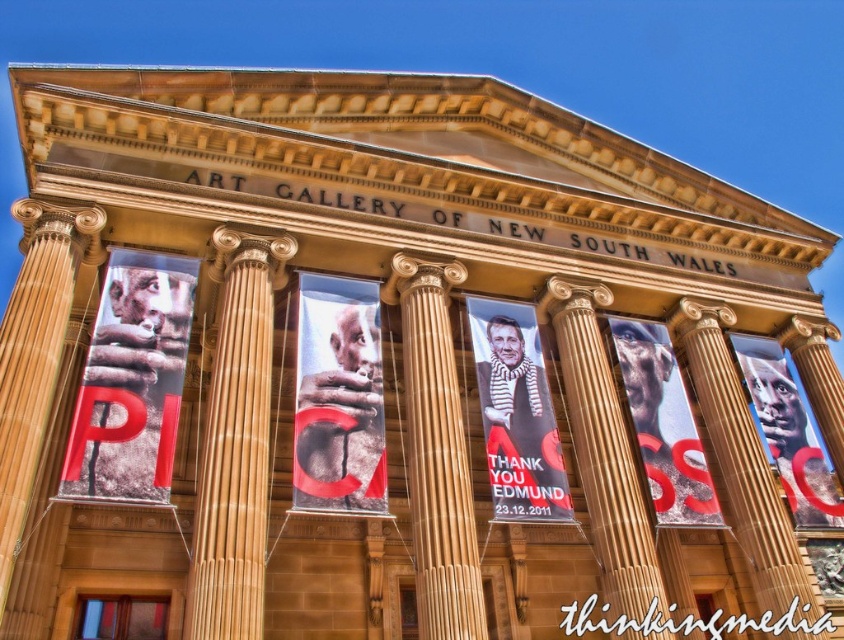
You are an event planner preparing for an outdoor exhibition. You have two items to display near the Art Gallery of New South Wales facade. The items are the matte black banner at left and the matte black face at center. Based on their sizes, which one should you choose if you want to place a larger promotional material near the entrance?

The matte black banner at left is larger in size than the matte black face at center, so you should choose the matte black banner at left for placing a larger promotional material near the entrance.

From the picture: You are an art student analyzing the banners in front of the Art Gallery of New South Wales. You notice two banners labeled as the matte black portrait at center and the matte black face at center. Which banner has a smaller size?

The matte black portrait at center is smaller than the matte black face at center, so the matte black portrait at center is the smaller one.

You are an art student analyzing the banners in front of the Art Gallery of New South Wales. You notice two banners labeled as the matte black portrait at center and the matte black face at center. Which banner has a smaller width?

The matte black portrait at center has a lesser width compared to the matte black face at center, so the matte black portrait at center is the smaller one in width.